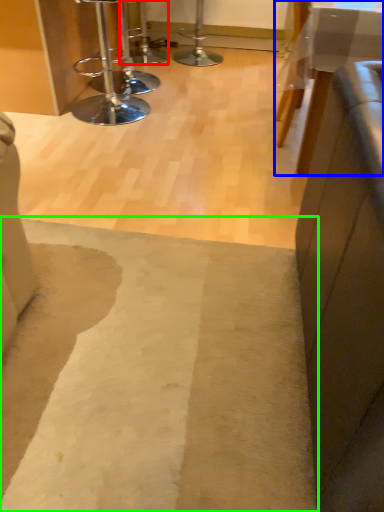
Question: Which object is the closest to the bar stool (highlighted by a red box)? Choose among these: table (highlighted by a blue box) or mat (highlighted by a green box).

Choices:
 (A) table
 (B) mat

Answer: (A)